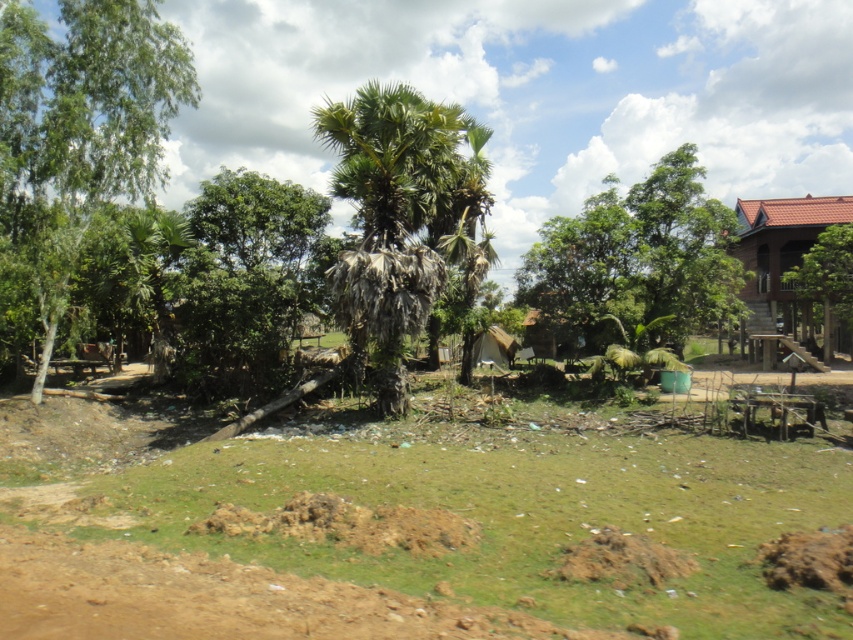
Based on the photo, which of these two, green leafy tree at left or green leafy palm tree at center, stands shorter?

green leafy tree at left is shorter.

Does green leafy tree at left have a greater height compared to green leafy palm tree at center?

No, green leafy tree at left is not taller than green leafy palm tree at center.

Is point (50, 352) positioned in front of point (440, 182)?

No, it is behind (440, 182).

Identify the location of green leafy tree at left. This screenshot has width=853, height=640. (74, 141).

This screenshot has width=853, height=640. What do you see at coordinates (74, 141) in the screenshot?
I see `green leafy tree at left` at bounding box center [74, 141].

Is green leafy tree at left positioned before brown wooden hut at right?

That is True.

Is point (151, 131) positioned after point (753, 200)?

No, it is not.

Identify the location of green leafy tree at left. (74, 141).

Between green leafy tree at left and green leafy tree at center, which one appears on the left side from the viewer's perspective?

Positioned to the left is green leafy tree at left.

Identify the location of green leafy tree at left. (74, 141).

This screenshot has height=640, width=853. Find the location of `green leafy tree at left`. green leafy tree at left is located at coordinates (74, 141).